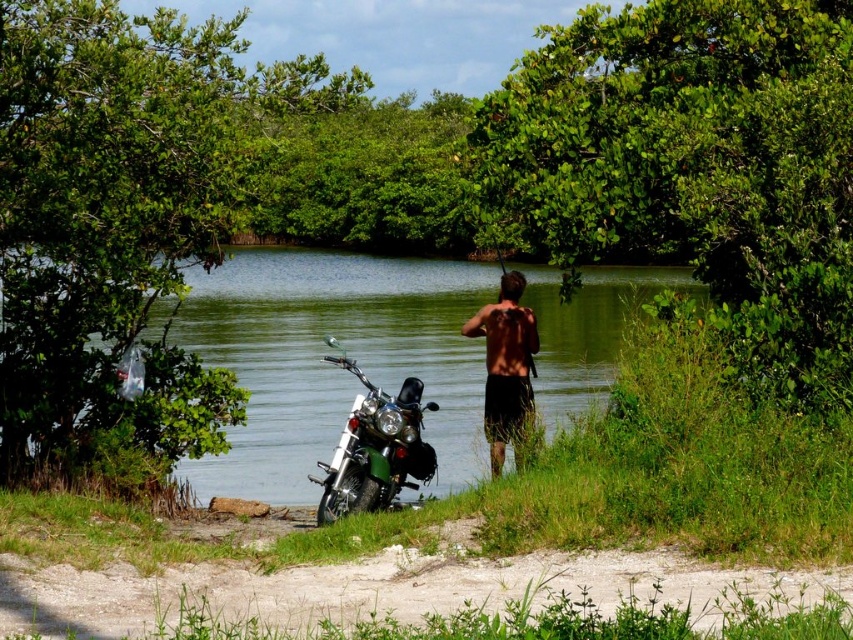
You are standing on the dirt path and want to take a photo of both the green leafy tree at upper center and the green metallic motorcycle at lower left. Which object should you focus on first to ensure both are in clear view?

You should focus on the green leafy tree at upper center first because it is closer to you than the green metallic motorcycle at lower left, so adjusting focus from near to far will help both be in clear view.

You are standing on the dirt path and want to take a photo of both the green leafy tree at left and the skinnysmoothtorso at center. Since the camera can only focus on one object at a time, which object should you focus on first to ensure it appears clearer in the photo?

The green leafy tree at left is closer to the viewer than the skinnysmoothtorso at center, so focusing on the green leafy tree at left first will ensure it appears clearer in the photo.